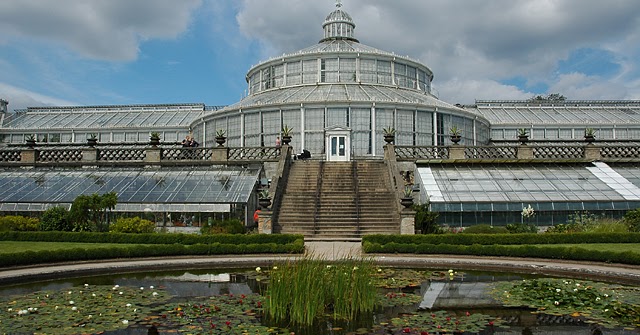
This screenshot has height=335, width=640. I want to click on vase, so click(x=392, y=138).